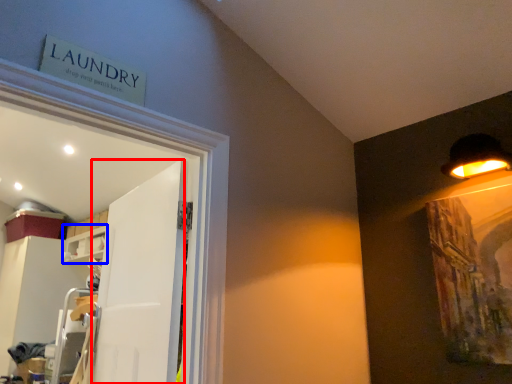
Question: Which object appears farthest to the camera in this image, door (highlighted by a red box) or shelf (highlighted by a blue box)?

Choices:
 (A) door
 (B) shelf

Answer: (B)